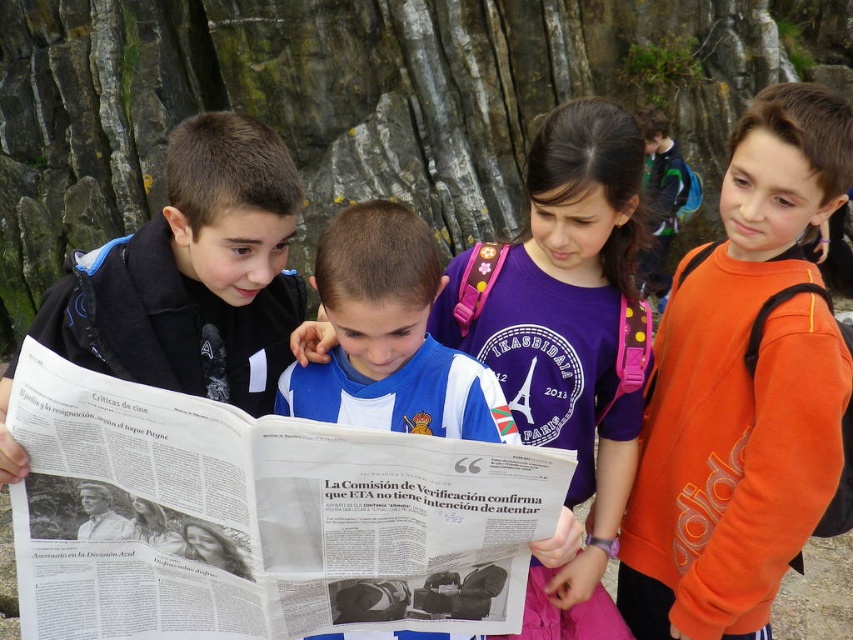
Question: Can you confirm if blue jersey at center is positioned to the right of matte black jacket at center?

Choices:
 (A) yes
 (B) no

Answer: (A)

Question: Which object is closer to the camera taking this photo?

Choices:
 (A) blue jersey at center
 (B) orange fleece sweatshirt at right
 (C) white paper at center

Answer: (C)

Question: Based on their relative distances, which object is farther from the matte black jacket at center?

Choices:
 (A) white paper at center
 (B) blue jersey at center

Answer: (B)

Question: Is blue jersey at center to the left of matte black jacket at center from the viewer's perspective?

Choices:
 (A) no
 (B) yes

Answer: (A)

Question: Is orange fleece sweatshirt at right closer to camera compared to blue jersey at center?

Choices:
 (A) yes
 (B) no

Answer: (B)

Question: Which of these objects is positioned farthest from the matte black jacket at center?

Choices:
 (A) blue jersey at center
 (B) white paper at center
 (C) orange fleece sweatshirt at right

Answer: (C)